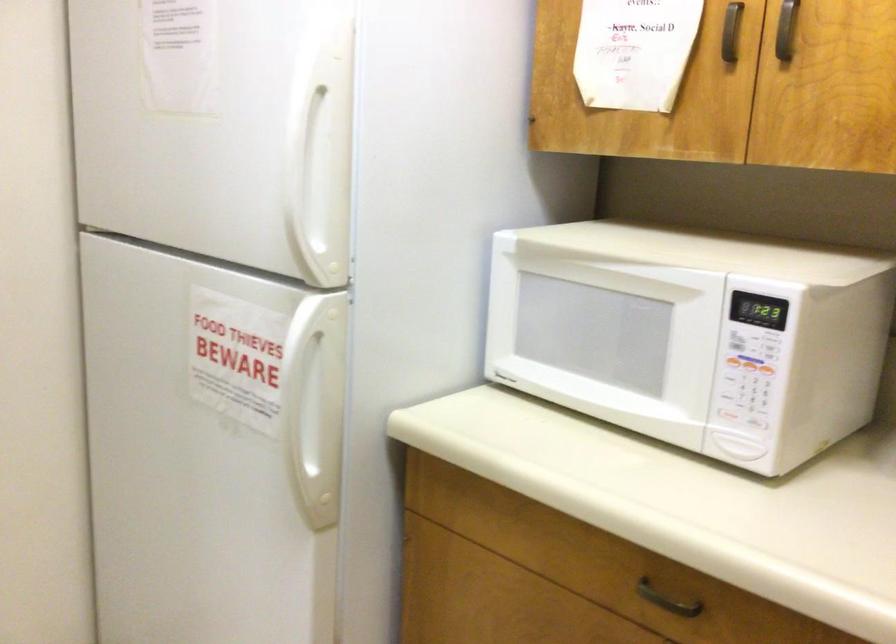
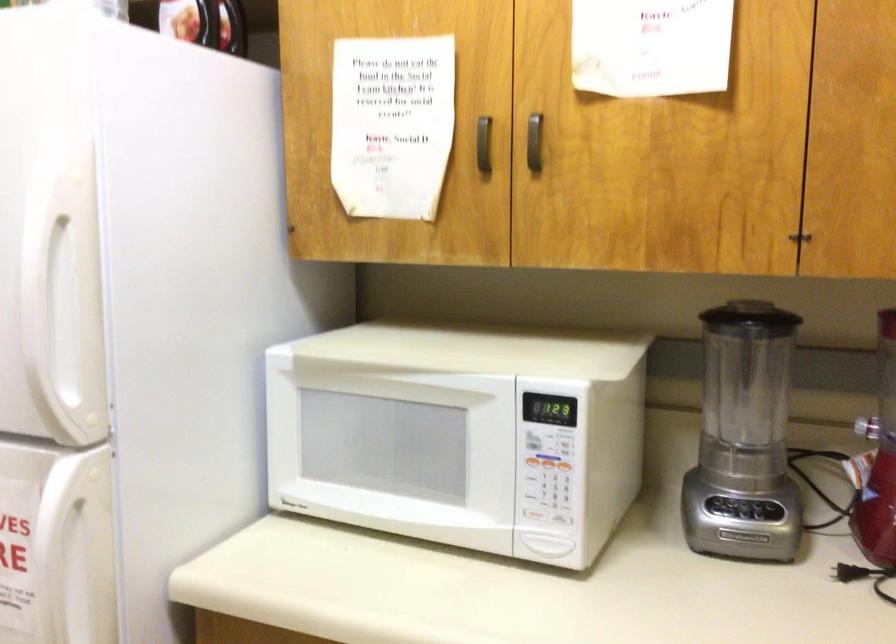
The point at (730, 357) is marked in the first image. Where is the corresponding point in the second image?

(530, 462)